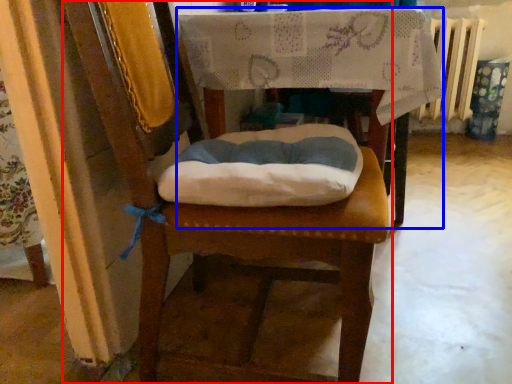
Question: Which point is closer to the camera, chair (highlighted by a red box) or table (highlighted by a blue box)?

Choices:
 (A) chair
 (B) table

Answer: (A)